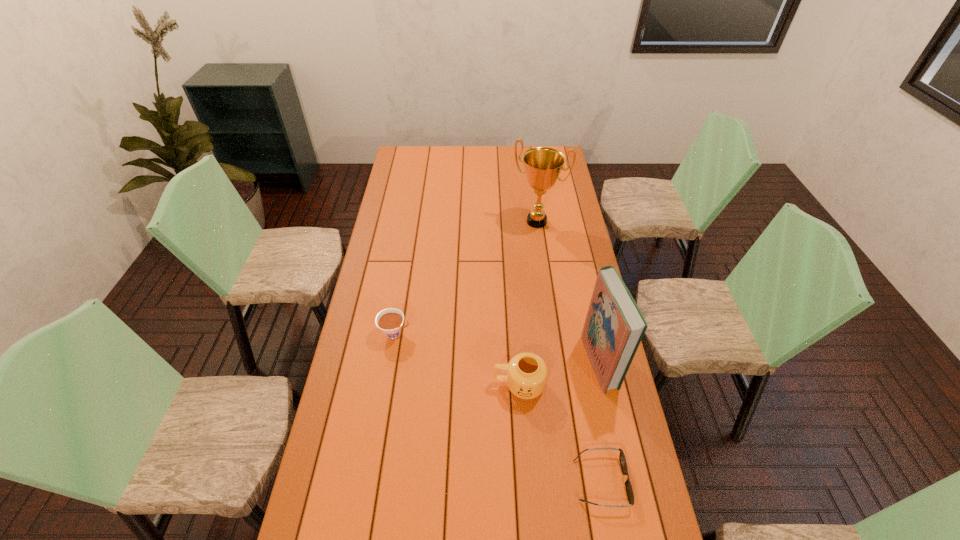
Locate an element on the screen. The image size is (960, 540). vacant spot on the desktop that is between the leftmost object and the sunglasses and is positioned on the front view with handles of the farthest object is located at coordinates (463, 382).

What are the coordinates of `vacant space on the desktop that is between the second shortest object and the nearest object and is positioned on the handle side of the third shortest object` in the screenshot? It's located at (457, 378).

At what (x,y) coordinates should I click in order to perform the action: click on free space on the desktop that is between the second shortest object and the nearest object and is positioned on the cover of the hardback book. Please return your answer as a coordinate pair (x, y). The width and height of the screenshot is (960, 540). Looking at the image, I should click on (464, 383).